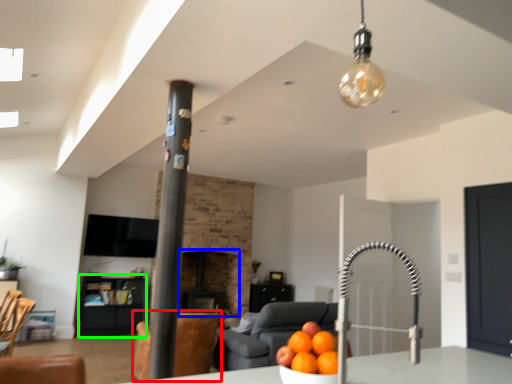
Question: Considering the real-world distances, which object is closest to swivel chair (highlighted by a red box)? fireplace (highlighted by a blue box) or furniture (highlighted by a green box).

Choices:
 (A) fireplace
 (B) furniture

Answer: (A)